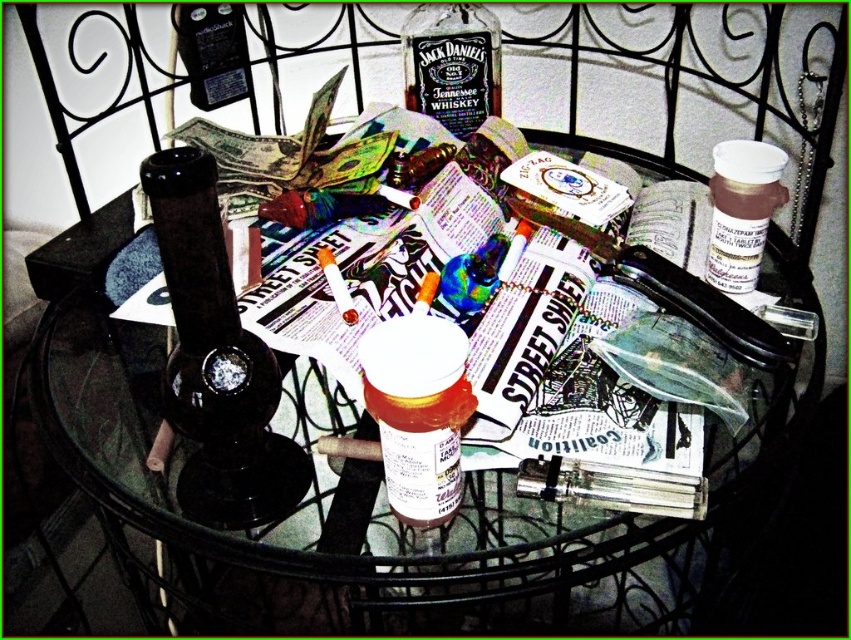
Question: Which of the following is the farthest from the observer?

Choices:
 (A) translucent plastic pill bottle at center
 (B) black glass bong at center

Answer: (A)

Question: Is black glass bong at center above matte black bottle at upper center?

Choices:
 (A) yes
 (B) no

Answer: (B)

Question: Can you confirm if matte black bottle at upper center is bigger than white plastic container at upper right?

Choices:
 (A) no
 (B) yes

Answer: (A)

Question: Is translucent plastic pill bottle at center smaller than white plastic container at upper right?

Choices:
 (A) no
 (B) yes

Answer: (B)

Question: Which of the following is the closest to the observer?

Choices:
 (A) white plastic container at upper right
 (B) black glass bong at center

Answer: (B)

Question: Among these objects, which one is nearest to the camera?

Choices:
 (A) white plastic container at upper right
 (B) matte black bottle at upper center
 (C) translucent plastic pill bottle at center
 (D) black glass bong at center

Answer: (D)